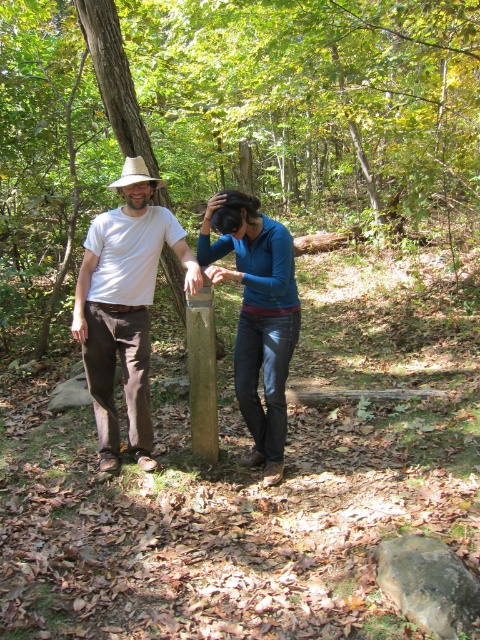
Is blue leather pants at center to the right of smooth brown wooden post at center from the viewer's perspective?

Indeed, blue leather pants at center is positioned on the right side of smooth brown wooden post at center.

Is point (282, 397) in front of point (204, 356)?

No, (282, 397) is further to viewer.

Who is more forward, (x=284, y=422) or (x=200, y=304)?

Point (x=200, y=304) is in front.

Find the location of a particular element. blue leather pants at center is located at coordinates (256, 316).

Can you confirm if blue leather pants at center is positioned to the left of white straw cowboy hat at left?

Incorrect, blue leather pants at center is not on the left side of white straw cowboy hat at left.

Who is lower down, blue leather pants at center or white straw cowboy hat at left?

blue leather pants at center

In order to click on blue leather pants at center in this screenshot , I will do `click(256, 316)`.

Is smooth wooden post at center in front of smooth brown wooden post at center?

No, it is behind smooth brown wooden post at center.

Can you confirm if smooth wooden post at center is wider than smooth brown wooden post at center?

Correct, the width of smooth wooden post at center exceeds that of smooth brown wooden post at center.

Which is in front, point (385, 131) or point (211, 404)?

Point (211, 404) is in front.

The width and height of the screenshot is (480, 640). What are the coordinates of `smooth wooden post at center` in the screenshot? It's located at (229, 115).